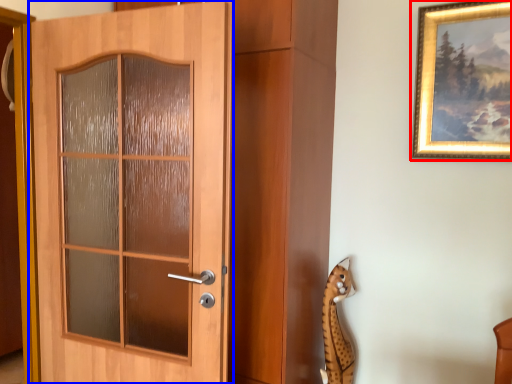
Question: Among these objects, which one is farthest to the camera, picture frame (highlighted by a red box) or door (highlighted by a blue box)?

Choices:
 (A) picture frame
 (B) door

Answer: (A)